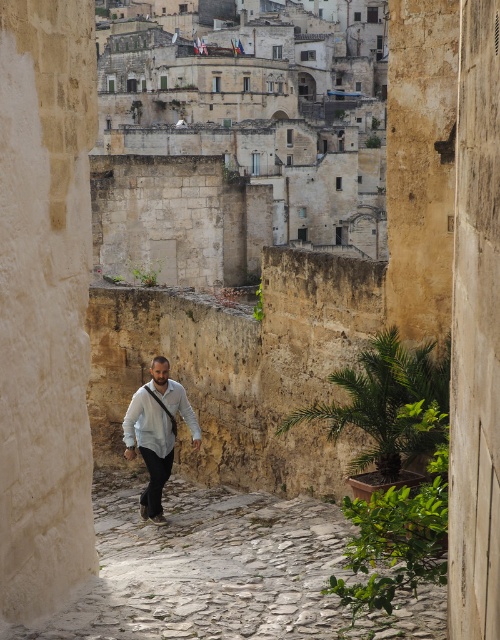
Question: Among these points, which one is nearest to the camera?

Choices:
 (A) (229, 67)
 (B) (138, 408)

Answer: (B)

Question: Based on their relative distances, which object is nearer to the white cotton shirt at center?

Choices:
 (A) stone cobblestone path at center
 (B) beige stone buildings at upper center
 (C) white matte shirt at center

Answer: (C)

Question: Does white matte shirt at center have a lesser width compared to white cotton shirt at center?

Choices:
 (A) no
 (B) yes

Answer: (B)

Question: Is beige stone buildings at upper center below white matte shirt at center?

Choices:
 (A) yes
 (B) no

Answer: (B)

Question: Which of the following is the farthest from the observer?

Choices:
 (A) stone cobblestone path at center
 (B) white cotton shirt at center

Answer: (B)

Question: Is stone cobblestone path at center smaller than white cotton shirt at center?

Choices:
 (A) yes
 (B) no

Answer: (B)